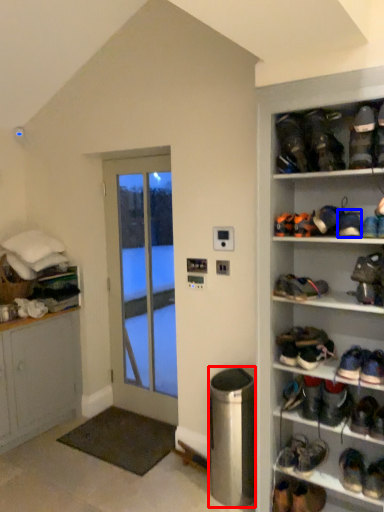
Question: Which point is closer to the camera, trash bin/can (highlighted by a red box) or footwear (highlighted by a blue box)?

Choices:
 (A) trash bin/can
 (B) footwear

Answer: (B)